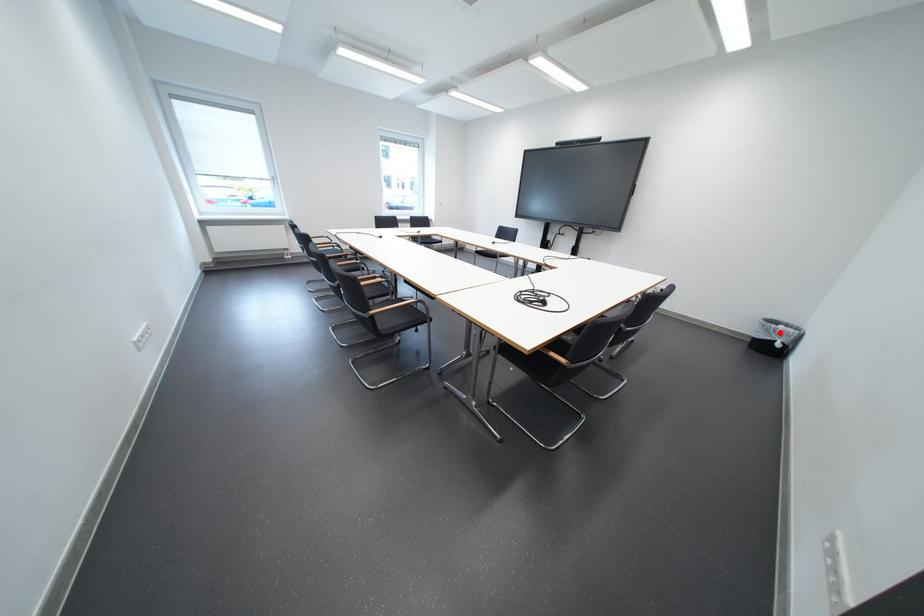
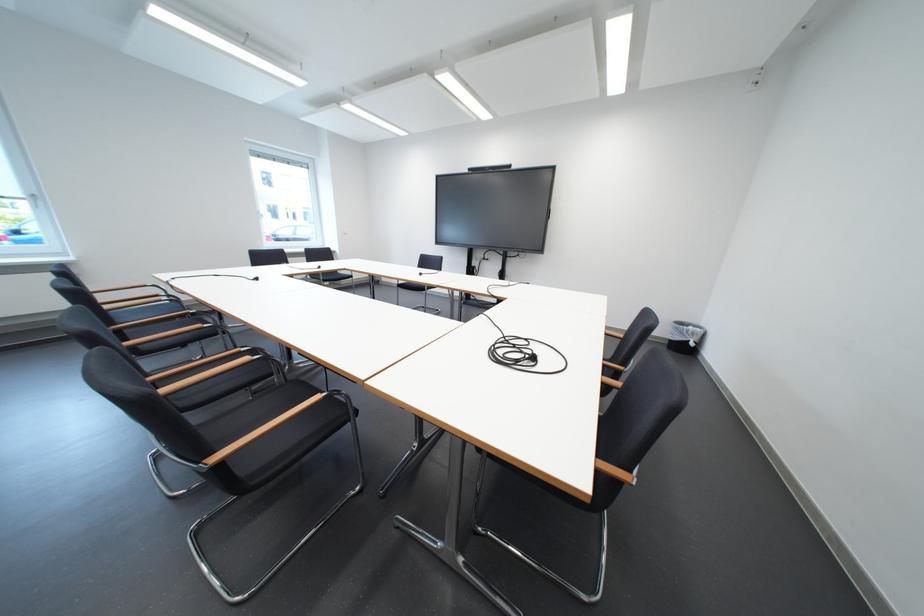
Question: I am providing you with two images of the same scene from different viewpoints. A red point is marked on the first image. Is the red point's position out of view in image 2?

Choices:
 (A) Yes
 (B) No

Answer: (B)